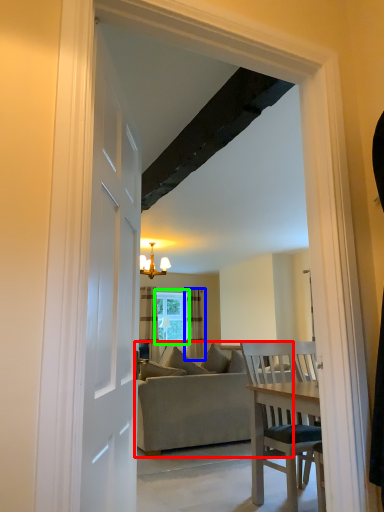
Question: Based on their relative distances, which object is nearer to studio couch (highlighted by a red box)? Choose from curtain (highlighted by a blue box) and window (highlighted by a green box).

Choices:
 (A) curtain
 (B) window

Answer: (A)